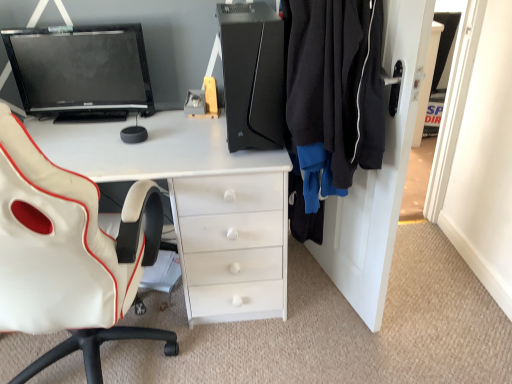
Question: In the image, is black fleece jacket at right positioned in front of or behind white leather chair at left?

Choices:
 (A) behind
 (B) front

Answer: (A)

Question: Looking at the image, does black fleece jacket at right seem bigger or smaller compared to white leather chair at left?

Choices:
 (A) small
 (B) big

Answer: (A)

Question: Which object is the farthest from the black matte dresser at right?

Choices:
 (A) matte black monitor at upper left
 (B) black fleece jacket at right
 (C) white glossy desk at center
 (D) white leather chair at left
 (E) black matte computer tower at center

Answer: (A)

Question: Which object is the farthest from the white glossy desk at center?

Choices:
 (A) white leather chair at left
 (B) black matte computer tower at center
 (C) black matte dresser at right
 (D) matte black monitor at upper left
 (E) black fleece jacket at right

Answer: (C)